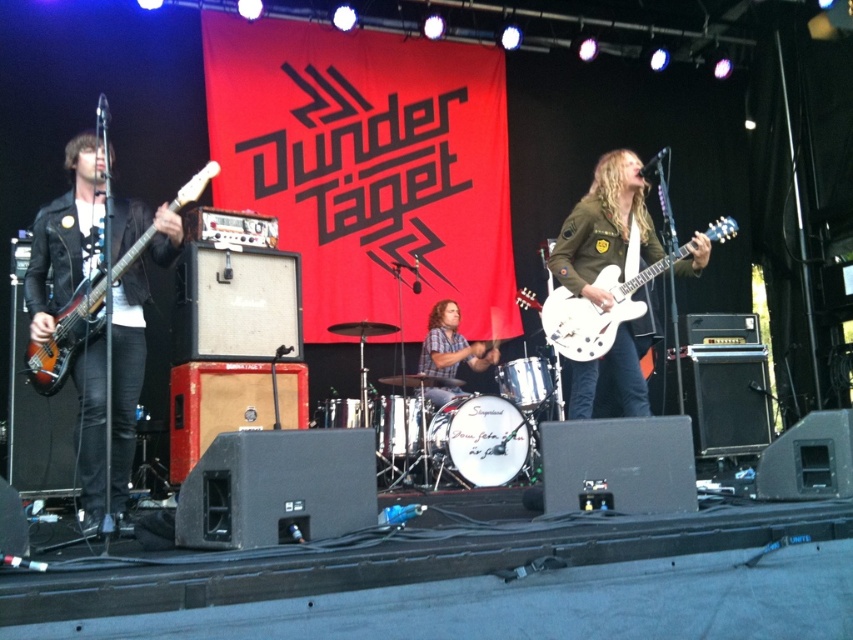
Between point (94, 310) and point (445, 332), which one is positioned behind?

The point (445, 332) is behind.

Does point (68, 337) lie in front of point (456, 388)?

Yes, it is.

Locate an element on the screen. This screenshot has width=853, height=640. matte brown electric guitar at left is located at coordinates (76, 323).

Who is shorter, white glossy electric guitar at center or matte brown electric guitar at left?

white glossy electric guitar at center

Which of these two, white glossy electric guitar at center or matte brown electric guitar at left, stands taller?

Standing taller between the two is matte brown electric guitar at left.

Is point (602, 328) positioned in front of point (99, 291)?

No, it is not.

I want to click on white glossy electric guitar at center, so click(x=593, y=314).

Can you confirm if white glossy electric guitar at center is smaller than wooden drum set at center?

Correct, white glossy electric guitar at center occupies less space than wooden drum set at center.

Is white glossy electric guitar at center to the left of wooden drum set at center from the viewer's perspective?

Incorrect, white glossy electric guitar at center is not on the left side of wooden drum set at center.

Which is behind, point (727, 237) or point (457, 348)?

The point (457, 348) is more distant.

Where is `white glossy electric guitar at center`? The image size is (853, 640). white glossy electric guitar at center is located at coordinates (593, 314).